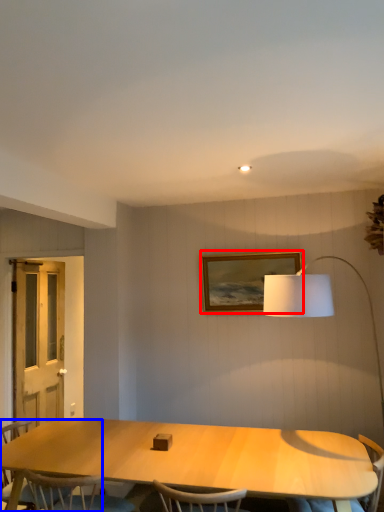
Question: Which point is closer to the camera, picture frame (highlighted by a red box) or chair (highlighted by a blue box)?

Choices:
 (A) picture frame
 (B) chair

Answer: (B)